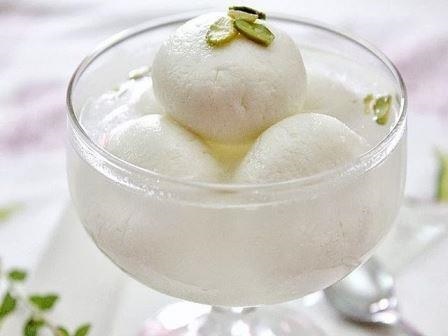
Identify the location of glass stem. (236, 311).